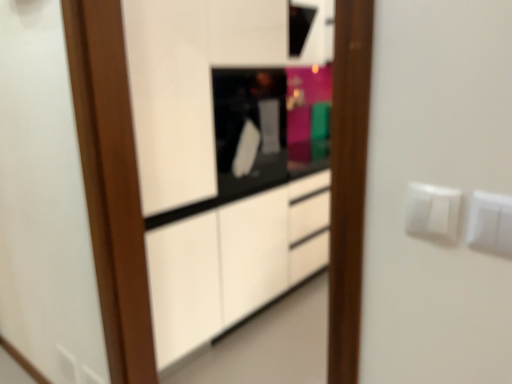
Where is `black glossy microwave at center`? This screenshot has width=512, height=384. black glossy microwave at center is located at coordinates point(250,128).

The image size is (512, 384). In order to click on white plastic electric outlet at right, which is the second electric outlet in bottom-to-top order in this screenshot , I will do `click(490, 223)`.

Identify the location of white plastic electric outlet at lower left, the first electric outlet in the back-to-front sequence. This screenshot has width=512, height=384. (68, 364).

In terms of width, does white plastic electric outlet at right, which is the 1th electric outlet in right-to-left order, look wider or thinner when compared to white plastic electric outlet at lower left, the 3th electric outlet positioned from the top?

Considering their sizes, white plastic electric outlet at right, which is the 1th electric outlet in right-to-left order, looks broader than white plastic electric outlet at lower left, the 3th electric outlet positioned from the top.

Is white plastic electric outlet at lower left, the 3th electric outlet positioned from the top, located within white plastic electric outlet at right, which is the second electric outlet in bottom-to-top order?

No, white plastic electric outlet at lower left, the 3th electric outlet positioned from the top, is not a part of white plastic electric outlet at right, which is the second electric outlet in bottom-to-top order.

Which point is more forward, (483, 204) or (70, 359)?

The point (483, 204) is more forward.

From the image's perspective, is white plastic electric outlet at right, the second electric outlet when ordered from top to bottom, located above or below white plastic electric outlet at lower left, the 3th electric outlet from the right?

white plastic electric outlet at right, the second electric outlet when ordered from top to bottom, is situated higher than white plastic electric outlet at lower left, the 3th electric outlet from the right, in the image.

Considering the sizes of objects white plastic switch at upper right, which is the second electric outlet from front to back, and white plastic electric outlet at right, which is counted as the 3th electric outlet, starting from the back, in the image provided, who is shorter, white plastic switch at upper right, which is the second electric outlet from front to back, or white plastic electric outlet at right, which is counted as the 3th electric outlet, starting from the back,?

white plastic electric outlet at right, which is counted as the 3th electric outlet, starting from the back, is shorter.

From the picture: Considering the relative sizes of white plastic switch at upper right, the second electric outlet from the back, and white plastic electric outlet at right, which is the second electric outlet in bottom-to-top order, in the image provided, is white plastic switch at upper right, the second electric outlet from the back, wider than white plastic electric outlet at right, which is the second electric outlet in bottom-to-top order,?

No.

Can white plastic electric outlet at right, which is the second electric outlet in bottom-to-top order, be found inside white plastic switch at upper right, which ranks as the 2th electric outlet in left-to-right order?

No, white plastic switch at upper right, which ranks as the 2th electric outlet in left-to-right order, does not contain white plastic electric outlet at right, which is the second electric outlet in bottom-to-top order.

Considering the relative positions of white plastic switch at upper right, the second electric outlet from the back, and white plastic electric outlet at right, the second electric outlet when ordered from top to bottom, in the image provided, is white plastic switch at upper right, the second electric outlet from the back, to the right of white plastic electric outlet at right, the second electric outlet when ordered from top to bottom, from the viewer's perspective?

No, white plastic switch at upper right, the second electric outlet from the back, is not to the right of white plastic electric outlet at right, the second electric outlet when ordered from top to bottom.

From a real-world perspective, is white plastic electric outlet at lower left, the 3th electric outlet positioned from the top, physically located above or below white plastic electric outlet at right, which is the second electric outlet in bottom-to-top order?

white plastic electric outlet at lower left, the 3th electric outlet positioned from the top, is situated lower than white plastic electric outlet at right, which is the second electric outlet in bottom-to-top order, in the real world.

Does point (58, 347) come closer to viewer compared to point (509, 219)?

No, it is behind (509, 219).

Does white plastic electric outlet at lower left, the first electric outlet in the back-to-front sequence, have a greater height compared to white plastic electric outlet at right, marked as the 3th electric outlet in a left-to-right arrangement?

Correct, white plastic electric outlet at lower left, the first electric outlet in the back-to-front sequence, is much taller as white plastic electric outlet at right, marked as the 3th electric outlet in a left-to-right arrangement.

Between white plastic switch at upper right, positioned as the second electric outlet in right-to-left order, and white plastic electric outlet at lower left, the 3th electric outlet positioned from the top, which one has smaller width?

white plastic electric outlet at lower left, the 3th electric outlet positioned from the top.

From the image's perspective, is white plastic switch at upper right, which is the second electric outlet from front to back, under white plastic electric outlet at lower left, the first electric outlet in the back-to-front sequence?

Incorrect, from the image's perspective, white plastic switch at upper right, which is the second electric outlet from front to back, is higher than white plastic electric outlet at lower left, the first electric outlet in the back-to-front sequence.

Is point (458, 194) positioned before point (73, 366)?

Yes.

Is the position of white plastic switch at upper right, which is the second electric outlet from front to back, more distant than that of white plastic electric outlet at lower left, the 3th electric outlet from the right?

No, it is in front of white plastic electric outlet at lower left, the 3th electric outlet from the right.

From a real-world perspective, which object stands above the other?

white plastic switch at upper right, the second electric outlet from the back, from a real-world perspective.

Is white plastic electric outlet at lower left, the 3th electric outlet positioned from the top, inside the boundaries of white plastic switch at upper right, positioned as the second electric outlet in right-to-left order, or outside?

white plastic electric outlet at lower left, the 3th electric outlet positioned from the top, is spatially situated outside white plastic switch at upper right, positioned as the second electric outlet in right-to-left order.

From the image's perspective, is white plastic electric outlet at lower left, the first electric outlet in the back-to-front sequence, located above white plastic switch at upper right, the second electric outlet from the back?

No, from the image's perspective, white plastic electric outlet at lower left, the first electric outlet in the back-to-front sequence, is not over white plastic switch at upper right, the second electric outlet from the back.

Visually, is white plastic electric outlet at lower left, the 3th electric outlet from the right, positioned to the left or to the right of white plastic switch at upper right, positioned as the second electric outlet in right-to-left order?

In the image, white plastic electric outlet at lower left, the 3th electric outlet from the right, appears on the left side of white plastic switch at upper right, positioned as the second electric outlet in right-to-left order.

Is black glossy microwave at center in front of or behind white plastic electric outlet at right, marked as the 3th electric outlet in a left-to-right arrangement, in the image?

Visually, black glossy microwave at center is located behind white plastic electric outlet at right, marked as the 3th electric outlet in a left-to-right arrangement.

Is black glossy microwave at center inside the boundaries of white plastic electric outlet at right, which is counted as the 3th electric outlet, starting from the back, or outside?

black glossy microwave at center lies outside white plastic electric outlet at right, which is counted as the 3th electric outlet, starting from the back.

Can you confirm if black glossy microwave at center is smaller than white plastic electric outlet at right, which is the second electric outlet in bottom-to-top order?

No, black glossy microwave at center is not smaller than white plastic electric outlet at right, which is the second electric outlet in bottom-to-top order.

Is point (229, 88) in front of point (468, 224)?

That is False.

Is black glossy microwave at center outside of white plastic switch at upper right, the second electric outlet from the back?

black glossy microwave at center is positioned outside white plastic switch at upper right, the second electric outlet from the back.

Considering the relative sizes of black glossy microwave at center and white plastic switch at upper right, positioned as the second electric outlet in right-to-left order, in the image provided, is black glossy microwave at center shorter than white plastic switch at upper right, positioned as the second electric outlet in right-to-left order,?

Incorrect, the height of black glossy microwave at center does not fall short of that of white plastic switch at upper right, positioned as the second electric outlet in right-to-left order.

From the image's perspective, which is above, black glossy microwave at center or white plastic switch at upper right, the second electric outlet from the back?

black glossy microwave at center, from the image's perspective.

Who is smaller, black glossy microwave at center or white plastic switch at upper right, the second electric outlet from the back?

white plastic switch at upper right, the second electric outlet from the back.

The image size is (512, 384). I want to click on the 2nd electric outlet behind when counting from the white plastic electric outlet at right, positioned as the first electric outlet in front-to-back order, so click(x=68, y=364).

Identify the location of electric outlet that is the 1st object to the left of the white plastic electric outlet at right, which is counted as the 3th electric outlet, starting from the back, starting at the anchor. The image size is (512, 384). (433, 211).

Looking at the image, which one is located closer to white plastic electric outlet at right, which is the 1th electric outlet in right-to-left order, white plastic electric outlet at lower left, the first electric outlet ordered from the bottom, or white plastic switch at upper right, which ranks as the 2th electric outlet in left-to-right order?

white plastic switch at upper right, which ranks as the 2th electric outlet in left-to-right order.

Estimate the real-world distances between objects in this image. Which object is further from white plastic electric outlet at lower left, positioned as the 1th electric outlet in left-to-right order, white plastic electric outlet at right, marked as the 3th electric outlet in a left-to-right arrangement, or black glossy microwave at center?

Based on the image, white plastic electric outlet at right, marked as the 3th electric outlet in a left-to-right arrangement, appears to be further to white plastic electric outlet at lower left, positioned as the 1th electric outlet in left-to-right order.

When comparing their distances from white plastic electric outlet at lower left, which is the third electric outlet in front-to-back order, does white plastic switch at upper right, positioned as the second electric outlet in right-to-left order, or white plastic electric outlet at right, the second electric outlet when ordered from top to bottom, seem closer?

Among the two, white plastic switch at upper right, positioned as the second electric outlet in right-to-left order, is located nearer to white plastic electric outlet at lower left, which is the third electric outlet in front-to-back order.

When comparing their distances from white plastic switch at upper right, which is the first electric outlet in top-to-bottom order, does white plastic electric outlet at lower left, which is the third electric outlet in front-to-back order, or black glossy microwave at center seem further?

Based on the image, white plastic electric outlet at lower left, which is the third electric outlet in front-to-back order, appears to be further to white plastic switch at upper right, which is the first electric outlet in top-to-bottom order.

Considering their positions, is white plastic electric outlet at lower left, which is the third electric outlet in front-to-back order, positioned closer to black glossy microwave at center than white plastic electric outlet at right, which is the second electric outlet in bottom-to-top order?

white plastic electric outlet at lower left, which is the third electric outlet in front-to-back order, lies closer to black glossy microwave at center than the other object.

When comparing their distances from white plastic electric outlet at lower left, which is the third electric outlet in front-to-back order, does white plastic electric outlet at right, which is the second electric outlet in bottom-to-top order, or white plastic switch at upper right, which is the first electric outlet in top-to-bottom order, seem closer?

white plastic switch at upper right, which is the first electric outlet in top-to-bottom order.

Which object lies nearer to the anchor point white plastic switch at upper right, which ranks as the 2th electric outlet in left-to-right order, black glossy microwave at center or white plastic electric outlet at lower left, the first electric outlet ordered from the bottom?

black glossy microwave at center lies closer to white plastic switch at upper right, which ranks as the 2th electric outlet in left-to-right order, than the other object.

Which object lies further to the anchor point black glossy microwave at center, white plastic switch at upper right, which is the second electric outlet from front to back, or white plastic electric outlet at right, marked as the 3th electric outlet in a left-to-right arrangement?

The object further to black glossy microwave at center is white plastic electric outlet at right, marked as the 3th electric outlet in a left-to-right arrangement.

Locate an element on the screen. The width and height of the screenshot is (512, 384). electric outlet between white plastic switch at upper right, which ranks as the 2th electric outlet in left-to-right order, and black glossy microwave at center from front to back is located at coordinates (68, 364).

Where is `electric outlet between white plastic electric outlet at right, which is the second electric outlet in bottom-to-top order, and white plastic electric outlet at lower left, the first electric outlet in the back-to-front sequence, in the front-back direction`? This screenshot has width=512, height=384. electric outlet between white plastic electric outlet at right, which is the second electric outlet in bottom-to-top order, and white plastic electric outlet at lower left, the first electric outlet in the back-to-front sequence, in the front-back direction is located at coordinates (x=433, y=211).